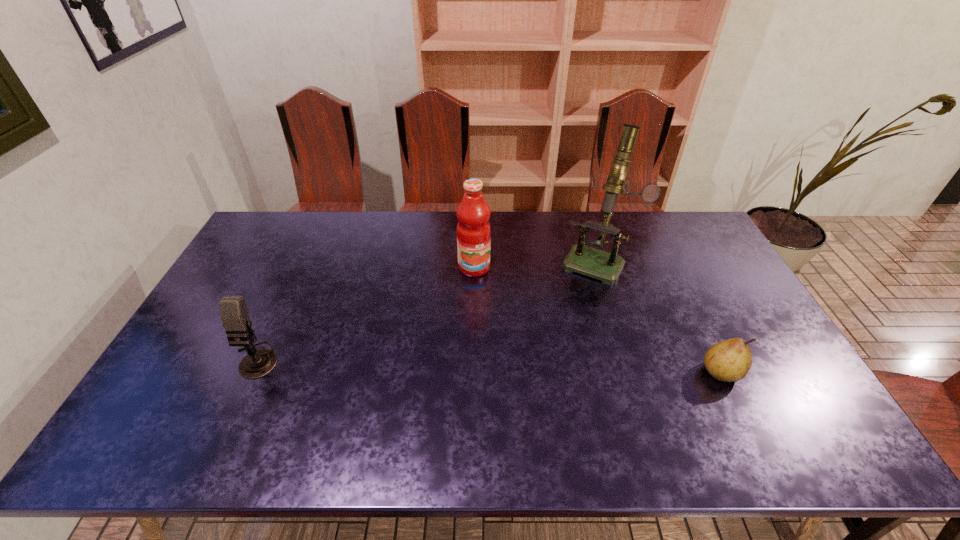
Where is `the third tallest object`? the third tallest object is located at coordinates (234, 313).

At what (x,y) coordinates should I click in order to perform the action: click on the leftmost object. Please return your answer as a coordinate pair (x, y). Image resolution: width=960 pixels, height=540 pixels. Looking at the image, I should click on (234, 313).

Find the location of a particular element. This screenshot has height=540, width=960. pear is located at coordinates (730, 360).

Identify the location of the rightmost object. The height and width of the screenshot is (540, 960). (730, 360).

Where is `fruit juice`? fruit juice is located at coordinates (473, 213).

Identify the location of the third object from right to left. (473, 213).

You are a GUI agent. You are given a task and a screenshot of the screen. Output one action in this format:
    pyautogui.click(x=<x>, y=<y>)
    Task: Click on the microscope
    The image size is (960, 540).
    Given the screenshot: What is the action you would take?
    pyautogui.click(x=592, y=262)

I want to click on the second object from right to left, so point(592,262).

Where is `vacant space located 0.070m on the front of the pear`? The image size is (960, 540). vacant space located 0.070m on the front of the pear is located at coordinates (741, 413).

The image size is (960, 540). What are the coordinates of `free region located 0.060m on the front label of the fruit juice` in the screenshot? It's located at (483, 290).